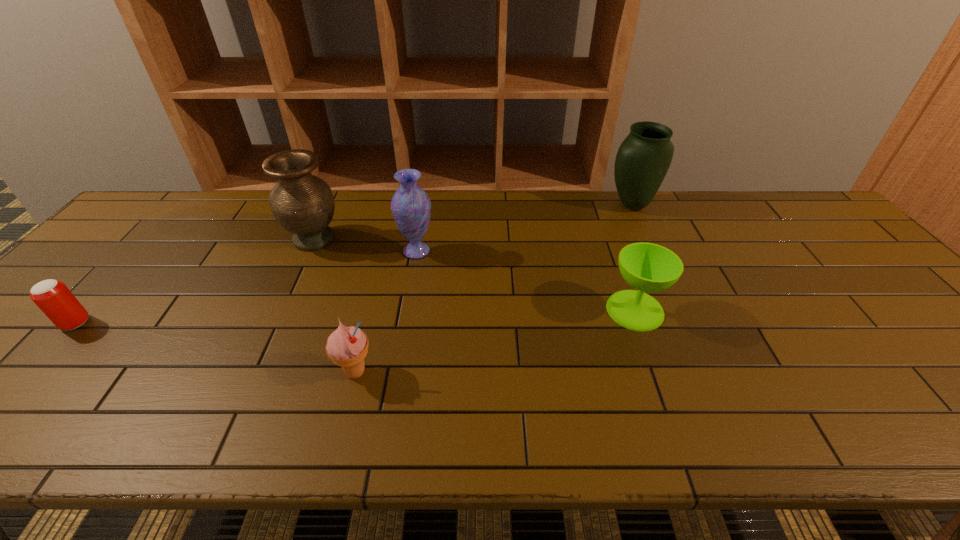
At what (x,y) coordinates should I click in order to perform the action: click on the farthest vase. Please return your answer as a coordinate pair (x, y). Looking at the image, I should click on (644, 157).

Where is `the farthest object`? This screenshot has width=960, height=540. the farthest object is located at coordinates (644, 157).

Locate an element on the screen. Image resolution: width=960 pixels, height=540 pixels. the second object from left to right is located at coordinates (303, 204).

The image size is (960, 540). I want to click on the second vase from left to right, so click(x=411, y=207).

Find the location of a particular element. The width and height of the screenshot is (960, 540). wineglass is located at coordinates (647, 267).

I want to click on the nearest object, so click(347, 347).

This screenshot has width=960, height=540. I want to click on beer can, so click(56, 301).

Locate an element on the screen. Image resolution: width=960 pixels, height=540 pixels. the shortest object is located at coordinates (56, 301).

Where is `free region located 0.100m on the left of the farthest object`? free region located 0.100m on the left of the farthest object is located at coordinates (574, 205).

I want to click on free space located on the left of the leftmost vase, so click(179, 239).